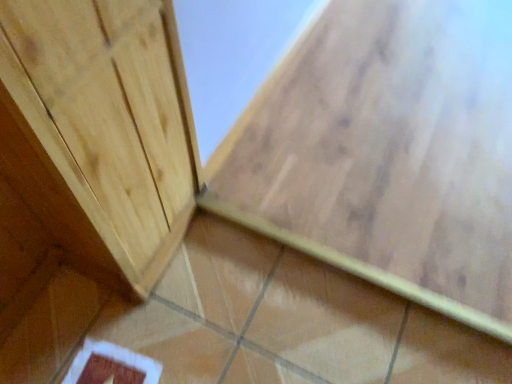
Question: Which direction should I rotate to look at brown glossy tile at lower center, the second ceramic tile positioned from the top, — up or down?

Choices:
 (A) down
 (B) up

Answer: (A)

Question: Is brown glossy tile at center, which is the 1th ceramic tile in top-to-bottom order, surrounded by brown glossy tile at lower center, the second ceramic tile positioned from the top?

Choices:
 (A) yes
 (B) no

Answer: (B)

Question: Is brown glossy tile at lower center, the second ceramic tile positioned from the top, positioned behind brown glossy tile at center, which is the second ceramic tile in bottom-to-top order?

Choices:
 (A) no
 (B) yes

Answer: (A)

Question: From the image's perspective, does brown glossy tile at lower center, which is the first ceramic tile from bottom to top, appear higher than brown glossy tile at center, which is the 1th ceramic tile in top-to-bottom order?

Choices:
 (A) yes
 (B) no

Answer: (B)

Question: Is brown glossy tile at lower center, which is the first ceramic tile from bottom to top, wider than brown glossy tile at center, which is the second ceramic tile in bottom-to-top order?

Choices:
 (A) yes
 (B) no

Answer: (B)

Question: Does brown glossy tile at lower center, the second ceramic tile positioned from the top, lie in front of brown glossy tile at center, which is the second ceramic tile in bottom-to-top order?

Choices:
 (A) no
 (B) yes

Answer: (B)

Question: Is brown glossy tile at lower center, the second ceramic tile positioned from the top, at the right side of brown glossy tile at center, which is the 1th ceramic tile in top-to-bottom order?

Choices:
 (A) no
 (B) yes

Answer: (A)

Question: Is brown glossy tile at center, which is the 1th ceramic tile in top-to-bottom order, positioned with its back to brown glossy tile at lower center, the second ceramic tile positioned from the top?

Choices:
 (A) yes
 (B) no

Answer: (B)

Question: Is brown glossy tile at center, which is the second ceramic tile in bottom-to-top order, bigger than brown glossy tile at lower center, which is the first ceramic tile from bottom to top?

Choices:
 (A) no
 (B) yes

Answer: (B)

Question: Is brown glossy tile at center, which is the second ceramic tile in bottom-to-top order, wider than brown glossy tile at lower center, which is the first ceramic tile from bottom to top?

Choices:
 (A) yes
 (B) no

Answer: (A)

Question: Is brown glossy tile at center, which is the second ceramic tile in bottom-to-top order, positioned behind brown glossy tile at lower center, the second ceramic tile positioned from the top?

Choices:
 (A) yes
 (B) no

Answer: (A)

Question: Is brown glossy tile at center, which is the second ceramic tile in bottom-to-top order, closer to camera compared to brown glossy tile at lower center, the second ceramic tile positioned from the top?

Choices:
 (A) yes
 (B) no

Answer: (B)

Question: From the image's perspective, is brown glossy tile at center, which is the second ceramic tile in bottom-to-top order, located above brown glossy tile at lower center, which is the first ceramic tile from bottom to top?

Choices:
 (A) no
 (B) yes

Answer: (B)

Question: Visually, is brown glossy tile at center, which is the 1th ceramic tile in top-to-bottom order, positioned to the left or to the right of brown glossy tile at lower center, the second ceramic tile positioned from the top?

Choices:
 (A) right
 (B) left

Answer: (A)